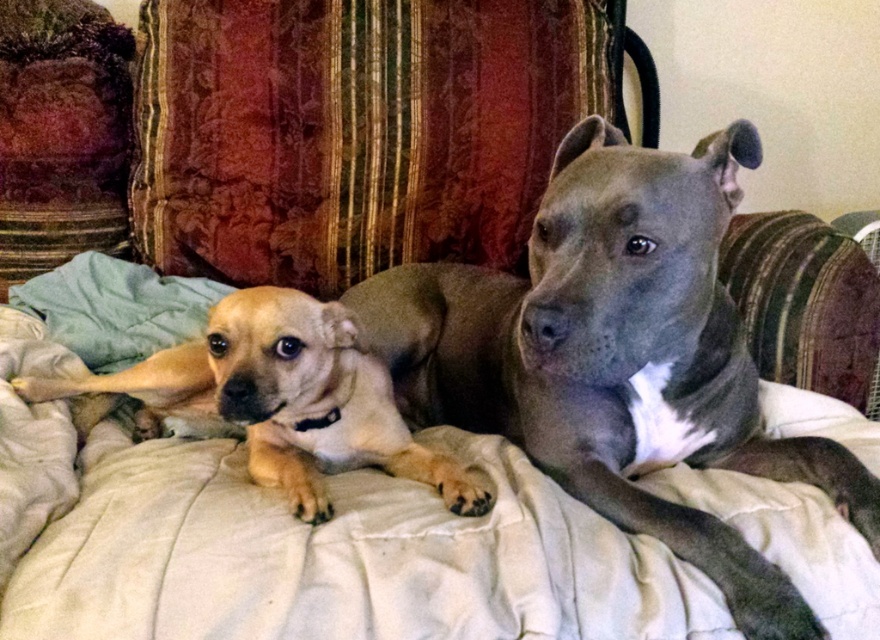
Question: Which object is the farthest from the velvet fabric couch at center?

Choices:
 (A) velvet cushion at upper center
 (B) smooth brown dog at center

Answer: (A)

Question: Which point is closer to the camera?

Choices:
 (A) (574, 314)
 (B) (418, 467)

Answer: (A)

Question: Which point is closer to the camera?

Choices:
 (A) (525, 324)
 (B) (81, 429)
 (C) (864, 378)

Answer: (A)

Question: Is smooth brown dog at center closer to camera compared to light brown fur at center?

Choices:
 (A) no
 (B) yes

Answer: (B)

Question: From the image, what is the correct spatial relationship of light brown fur at center in relation to velvet fabric couch at center?

Choices:
 (A) right
 (B) left

Answer: (B)

Question: Can you confirm if velvet cushion at upper center is wider than velvet fabric couch at center?

Choices:
 (A) no
 (B) yes

Answer: (B)